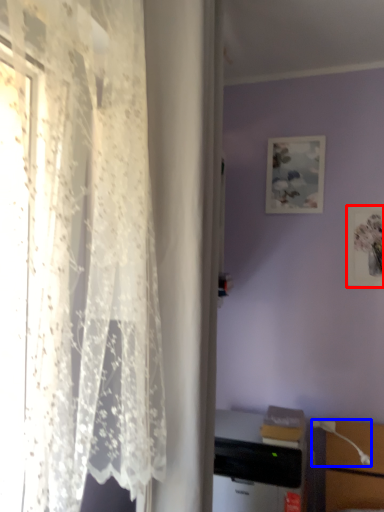
Question: Which of the following is the farthest to the observer, picture frame (highlighted by a red box) or table lamp (highlighted by a blue box)?

Choices:
 (A) picture frame
 (B) table lamp

Answer: (A)